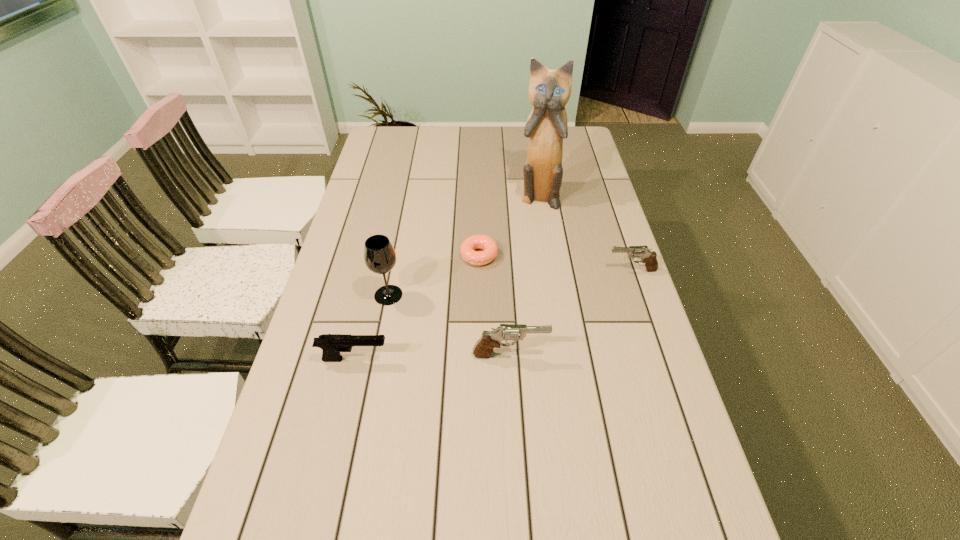
Identify the location of free space for a new pistol on the left. (331, 478).